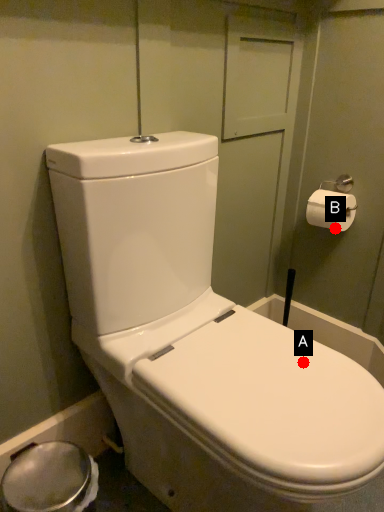
Question: Two points are circled on the image, labeled by A and B beside each circle. Which point is closer to the camera?

Choices:
 (A) A is closer
 (B) B is closer

Answer: (A)